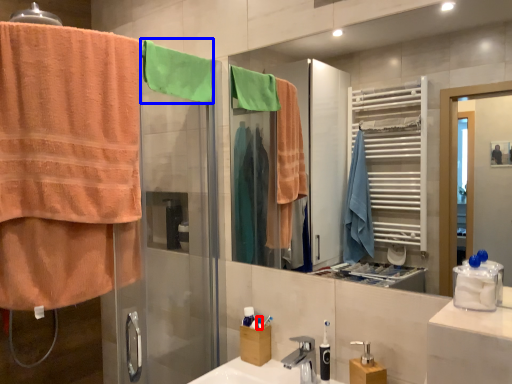
Question: Which object appears farthest to the camera in this image, toiletry (highlighted by a red box) or beach towel (highlighted by a blue box)?

Choices:
 (A) toiletry
 (B) beach towel

Answer: (A)